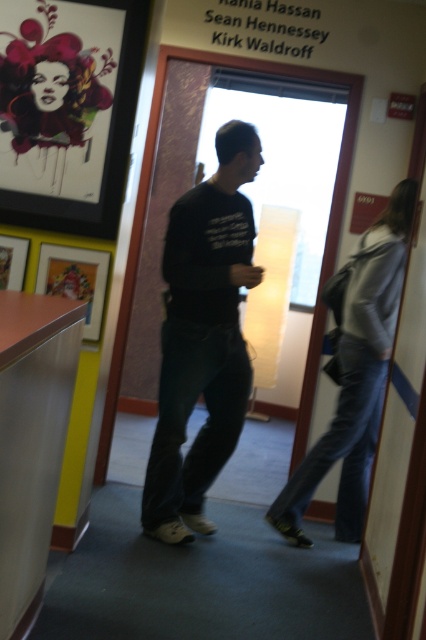
You are an interior designer assessing the office layout. You need to determine if the painted paper portrait at upper left can be placed above the metallic silver desk at lower left without exceeding the desk height. Can it be placed there?

The painted paper portrait at upper left is not as tall as the metallic silver desk at lower left, so it can be placed above the desk without exceeding its height.

You are an interior designer assessing the balance between the black matte shirt at center and the painted paper portrait at upper left in the office. Which object appears bigger in the scene?

The black matte shirt at center has a larger size compared to the painted paper portrait at upper left, so it appears bigger in the scene.

You are standing in the office and want to hang a new painting exactly where the painted paper portrait at upper left is currently located. What are the coordinates of the spot where you should place your new painting?

The coordinates for the painted paper portrait at upper left are at point (55, 96), so you should place your new painting there.